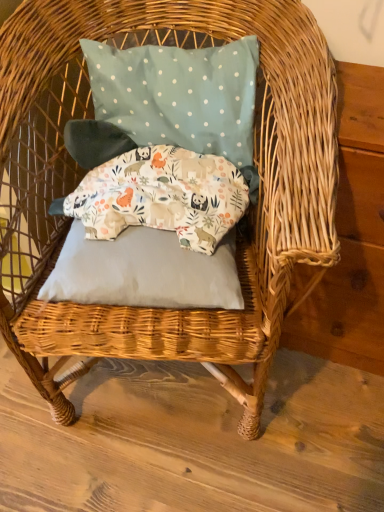
Question: Can you confirm if gray fabric pillow at center, arranged as the 3th pillow when viewed from the top, is wider than printed fabric pillow at center, placed as the second pillow when sorted from top to bottom?

Choices:
 (A) no
 (B) yes

Answer: (A)

Question: Can you confirm if gray fabric pillow at center, arranged as the 3th pillow when viewed from the top, is taller than printed fabric pillow at center, placed as the second pillow when sorted from top to bottom?

Choices:
 (A) yes
 (B) no

Answer: (B)

Question: Is gray fabric pillow at center, arranged as the first pillow when ordered from the bottom, thinner than printed fabric pillow at center, the second pillow positioned from the bottom?

Choices:
 (A) yes
 (B) no

Answer: (A)

Question: Is gray fabric pillow at center, arranged as the 3th pillow when viewed from the top, to the right of printed fabric pillow at center, the second pillow positioned from the bottom, from the viewer's perspective?

Choices:
 (A) yes
 (B) no

Answer: (B)

Question: Is gray fabric pillow at center, arranged as the first pillow when ordered from the bottom, positioned with its back to printed fabric pillow at center, the second pillow positioned from the bottom?

Choices:
 (A) yes
 (B) no

Answer: (B)

Question: Considering their positions, is printed fabric pillow at center, placed as the second pillow when sorted from top to bottom, located in front of or behind gray fabric pillow at center, arranged as the 3th pillow when viewed from the top?

Choices:
 (A) front
 (B) behind

Answer: (B)

Question: From the image's perspective, is printed fabric pillow at center, the second pillow positioned from the bottom, positioned above or below gray fabric pillow at center, arranged as the 3th pillow when viewed from the top?

Choices:
 (A) above
 (B) below

Answer: (A)

Question: Is point (155, 163) closer or farther from the camera than point (122, 266)?

Choices:
 (A) closer
 (B) farther

Answer: (B)

Question: Is printed fabric pillow at center, placed as the second pillow when sorted from top to bottom, wider or thinner than gray fabric pillow at center, arranged as the 3th pillow when viewed from the top?

Choices:
 (A) wide
 (B) thin

Answer: (A)

Question: Considering the positions of teal polka dot fabric pillow at upper center, the 1th pillow when ordered from top to bottom, and gray fabric pillow at center, arranged as the 3th pillow when viewed from the top, in the image, is teal polka dot fabric pillow at upper center, the 1th pillow when ordered from top to bottom, taller or shorter than gray fabric pillow at center, arranged as the 3th pillow when viewed from the top,?

Choices:
 (A) tall
 (B) short

Answer: (A)

Question: From the image's perspective, is teal polka dot fabric pillow at upper center, which ranks as the 3th pillow in bottom-to-top order, above or below gray fabric pillow at center, arranged as the 3th pillow when viewed from the top?

Choices:
 (A) below
 (B) above

Answer: (B)

Question: From a real-world perspective, relative to gray fabric pillow at center, arranged as the first pillow when ordered from the bottom, is teal polka dot fabric pillow at upper center, which ranks as the 3th pillow in bottom-to-top order, vertically above or below?

Choices:
 (A) below
 (B) above

Answer: (B)

Question: In the image, is teal polka dot fabric pillow at upper center, which ranks as the 3th pillow in bottom-to-top order, positioned in front of or behind gray fabric pillow at center, arranged as the 3th pillow when viewed from the top?

Choices:
 (A) behind
 (B) front

Answer: (A)

Question: Is gray fabric pillow at center, arranged as the first pillow when ordered from the bottom, bigger or smaller than teal polka dot fabric pillow at upper center, the 1th pillow when ordered from top to bottom?

Choices:
 (A) big
 (B) small

Answer: (B)

Question: From a real-world perspective, is gray fabric pillow at center, arranged as the first pillow when ordered from the bottom, positioned above or below teal polka dot fabric pillow at upper center, the 1th pillow when ordered from top to bottom?

Choices:
 (A) below
 (B) above

Answer: (A)